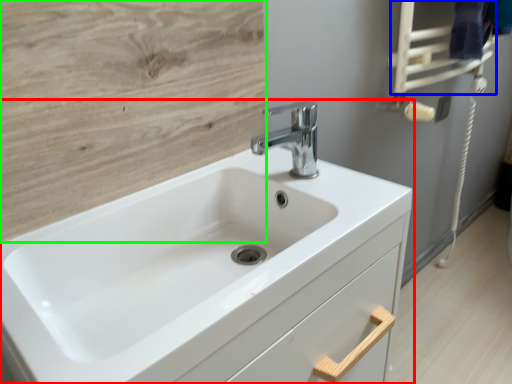
Question: Estimate the real-world distances between objects in this image. Which object is closer to sink (highlighted by a red box), towel bar (highlighted by a blue box) or plywood (highlighted by a green box)?

Choices:
 (A) towel bar
 (B) plywood

Answer: (B)